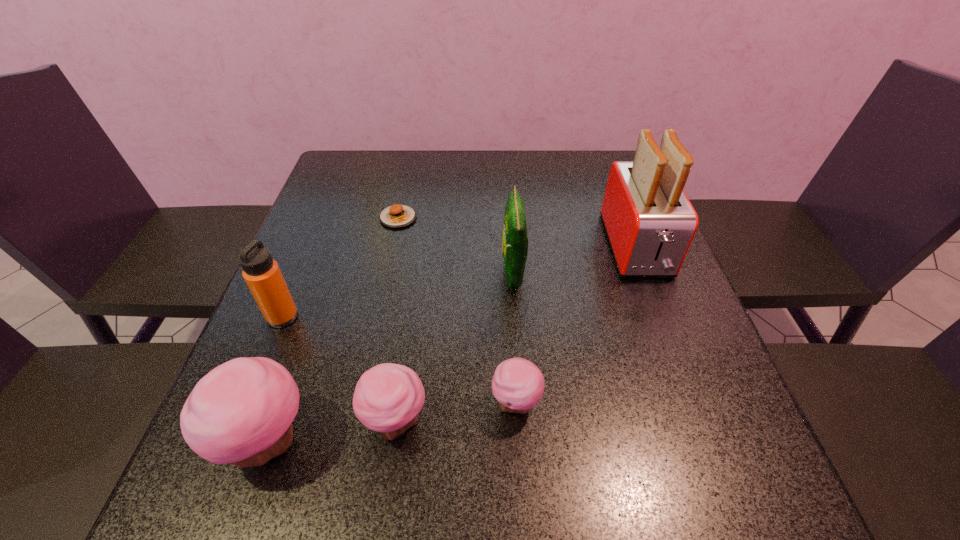
Locate an element on the screen. The image size is (960, 540). cupcake identified as the closest to the thermos bottle is located at coordinates (241, 412).

Locate an element on the screen. This screenshot has height=540, width=960. free space that satisfies the following two spatial constraints: 1. on the back side of the shortest object; 2. on the right side of the thermos bottle is located at coordinates (324, 218).

Find the location of a particular element. free location that satisfies the following two spatial constraints: 1. on the front-facing side of the tallest object; 2. on the front-facing side of the crisp (potato chip) is located at coordinates (646, 274).